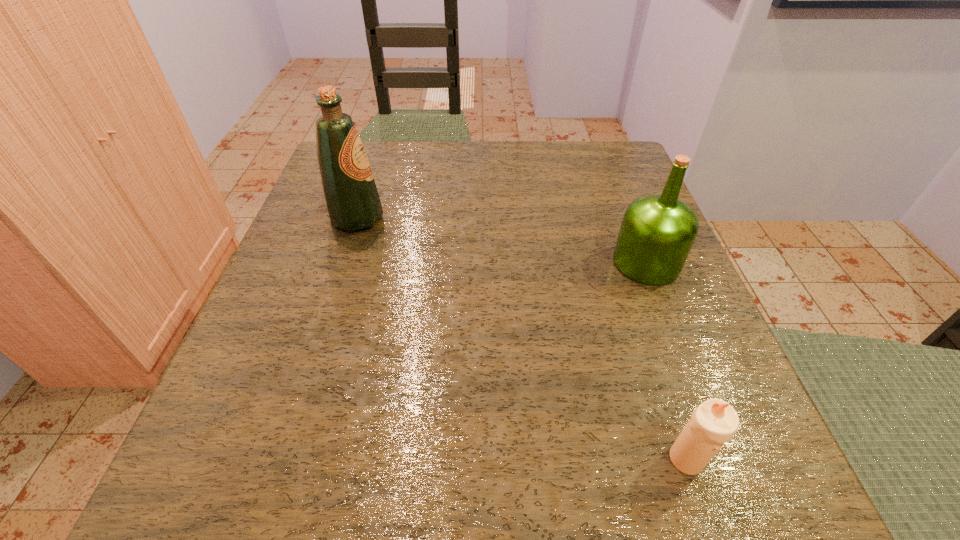
This screenshot has width=960, height=540. I want to click on object present at the left edge, so click(x=352, y=200).

Identify the location of olive oil present at the right edge. (657, 233).

Locate an element on the screen. candle at the right edge is located at coordinates (713, 423).

At what (x,y) coordinates should I click in order to perform the action: click on object located at the near right corner. Please return your answer as a coordinate pair (x, y). This screenshot has width=960, height=540. Looking at the image, I should click on (713, 423).

In the image, there is a desktop. Where is `vacant space at the far edge`? The image size is (960, 540). vacant space at the far edge is located at coordinates (544, 146).

Identify the location of free space at the near edge of the desktop. (602, 517).

In the image, there is a desktop. Where is `free space at the left edge`? This screenshot has height=540, width=960. free space at the left edge is located at coordinates (290, 333).

Image resolution: width=960 pixels, height=540 pixels. What are the coordinates of `vacant space at the right edge of the desktop` in the screenshot? It's located at (630, 309).

In the image, there is a desktop. In order to click on vacant region at the far right corner in this screenshot , I will do `click(567, 163)`.

The image size is (960, 540). I want to click on empty space between the candle and the nearer olive oil, so click(x=666, y=361).